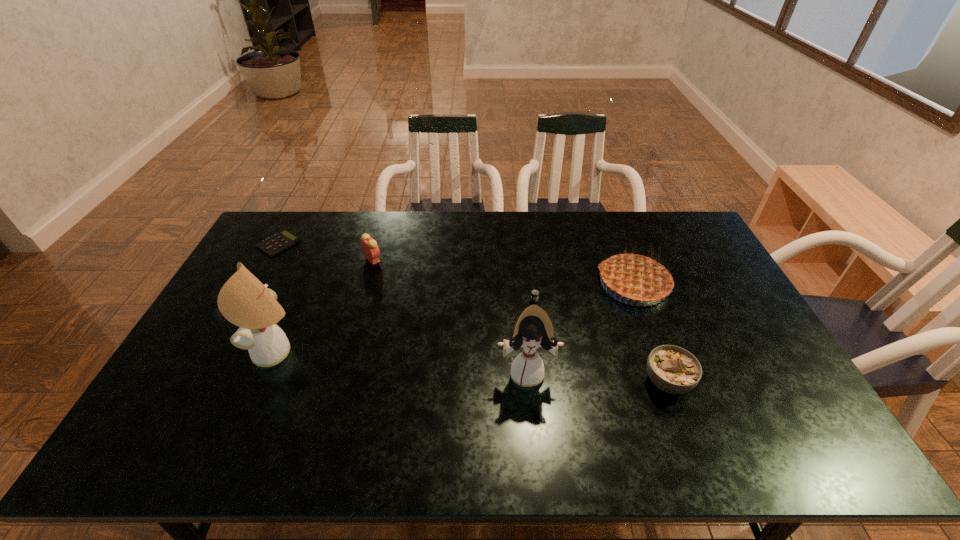
At what (x,y) coordinates should I click in order to perform the action: click on soup bowl. Please return your answer as a coordinate pair (x, y). Looking at the image, I should click on (674, 370).

The image size is (960, 540). I want to click on vacant point located at the front face of the sixth object from right to left, so click(206, 352).

Find the location of a particular element. free space located 0.160m at the front face of the sixth object from right to left is located at coordinates (195, 352).

At what (x,y) coordinates should I click in order to perform the action: click on free space located 0.170m at the front face of the sixth object from right to left. Please return your answer as a coordinate pair (x, y). This screenshot has width=960, height=540. Looking at the image, I should click on (192, 352).

Locate an element on the screen. vacant space located 0.330m on the right of the leftmost object is located at coordinates (391, 244).

Where is `vacant space located on the face of the fourth tallest object`? vacant space located on the face of the fourth tallest object is located at coordinates (449, 259).

You are a GUI agent. You are given a task and a screenshot of the screen. Output one action in this format:
    pyautogui.click(x=<x>, y=<y>)
    Task: Click on the vacant space located on the left of the beer can
    The image size is (960, 540).
    Given the screenshot: What is the action you would take?
    pyautogui.click(x=411, y=301)

Find the location of a particular element. Image resolution: width=960 pixels, height=540 pixels. vacant space positioned on the right of the pie is located at coordinates (731, 284).

This screenshot has height=540, width=960. Identify the location of vacant space positioned on the right of the soup bowl. (776, 382).

Locate an element on the screen. The width and height of the screenshot is (960, 540). object that is positioned at the far edge is located at coordinates (276, 243).